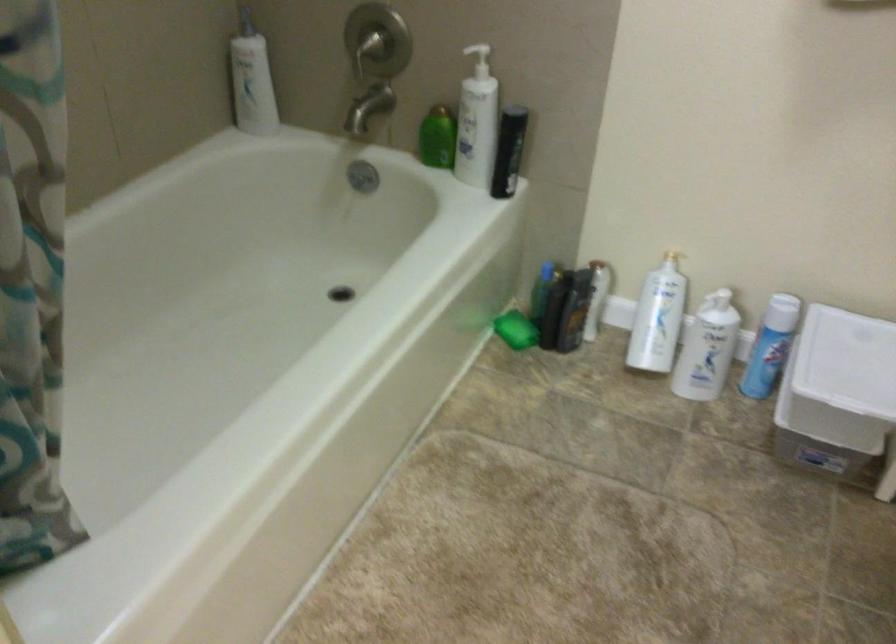
Find where to pull the faucet handle. Please return your answer as a coordinate pair (x, y).

(368, 108)